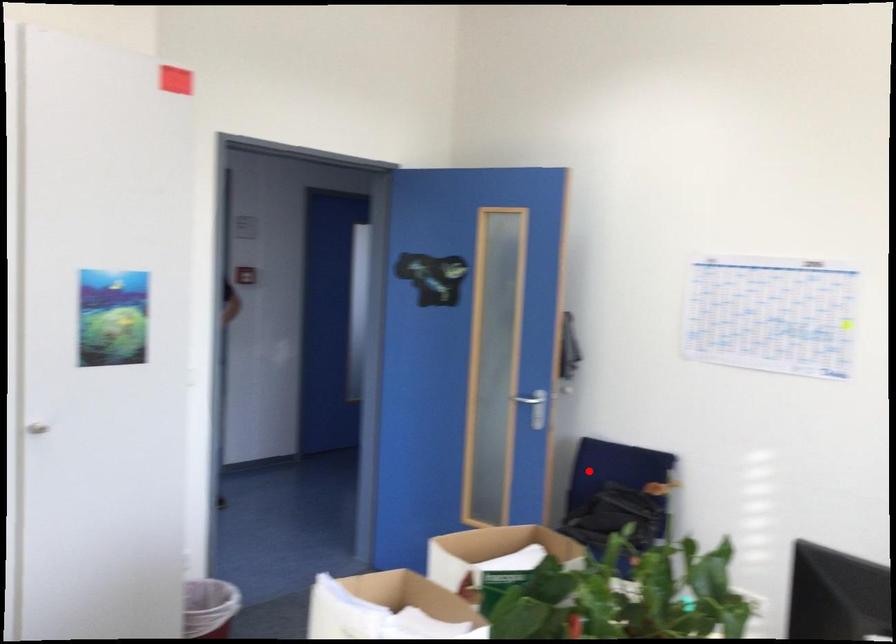
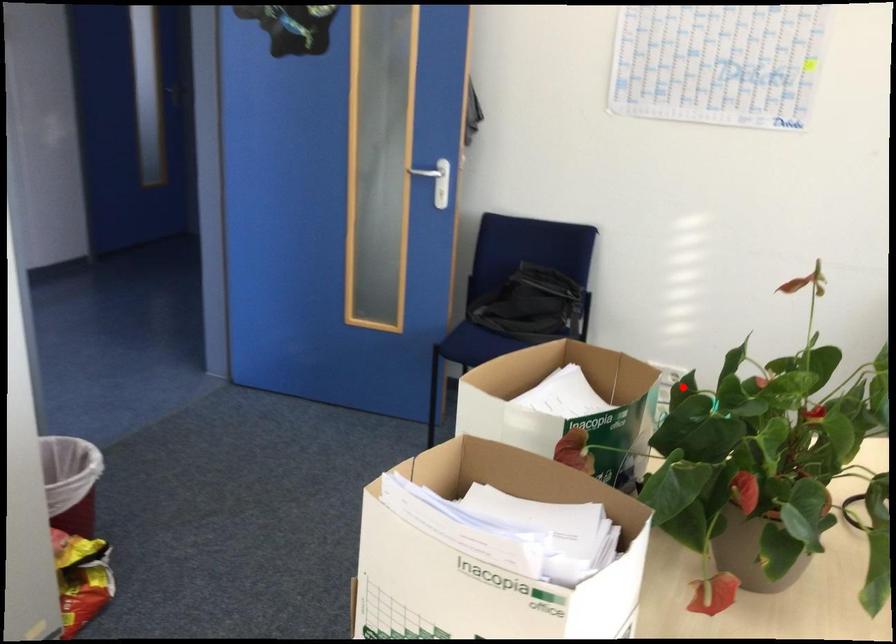
I am providing you with two images of the same scene from different viewpoints. A red point is marked on the first image and another point is marked on the second image. Do the highlighted points in image1 and image2 indicate the same real-world spot?

No